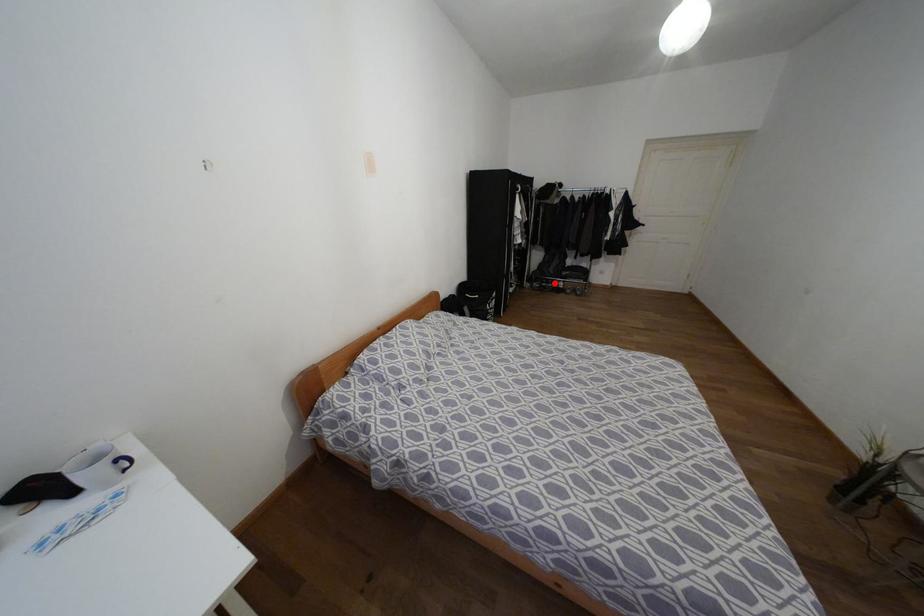
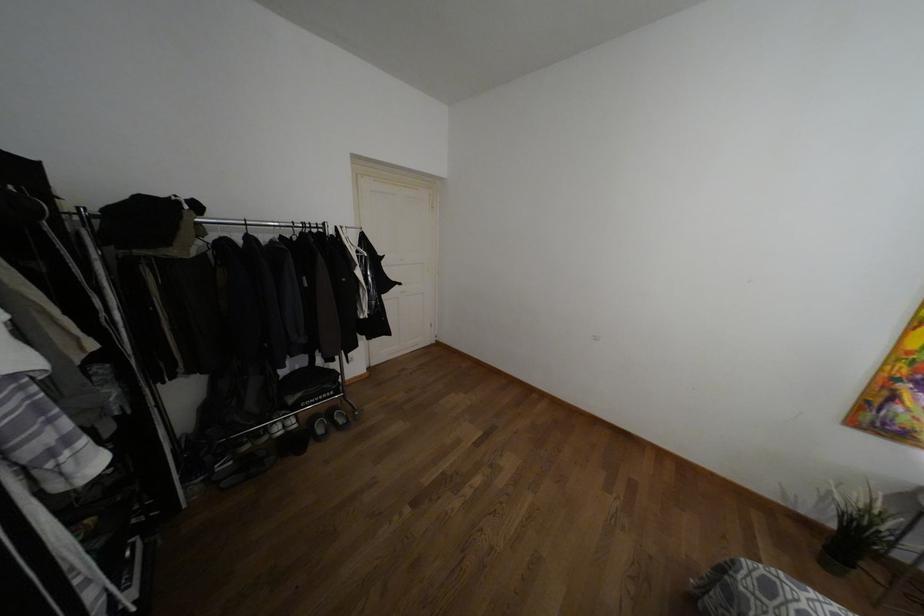
Question: I am providing you with two images of the same scene from different viewpoints. In image1, a red point is highlighted. Considering the same 3D point in image2, which of the following is correct?

Choices:
 (A) It is closer
 (B) It is farther

Answer: (B)